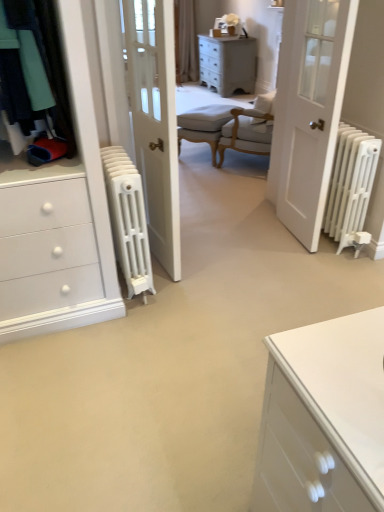
The image size is (384, 512). Find the location of `free space that is in between white matte radiator at left, which is counted as the 1th radiator, starting from the left, and white matte radiator at right, the 1th radiator viewed from the right`. free space that is in between white matte radiator at left, which is counted as the 1th radiator, starting from the left, and white matte radiator at right, the 1th radiator viewed from the right is located at coordinates click(245, 265).